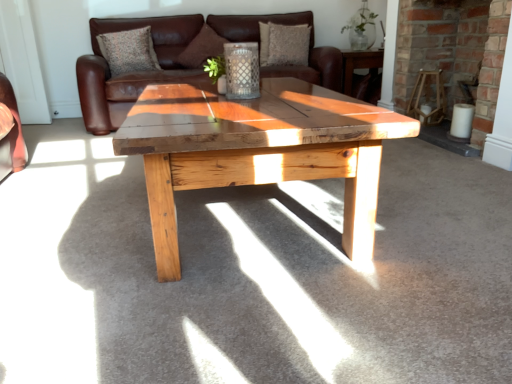
Question: Considering the relative sizes of brown suede pillow at center, which is the second pillow in right-to-left order, and brown leather couch at center in the image provided, is brown suede pillow at center, which is the second pillow in right-to-left order, shorter than brown leather couch at center?

Choices:
 (A) yes
 (B) no

Answer: (A)

Question: Is brown suede pillow at center, positioned as the second pillow in left-to-right order, aimed at brown leather couch at center?

Choices:
 (A) no
 (B) yes

Answer: (B)

Question: Is brown suede pillow at center, which is the second pillow in right-to-left order, not close to brown leather couch at center?

Choices:
 (A) no
 (B) yes

Answer: (A)

Question: From a real-world perspective, is brown suede pillow at center, which is the second pillow in right-to-left order, physically above brown leather couch at center?

Choices:
 (A) no
 (B) yes

Answer: (B)

Question: Is the depth of brown suede pillow at center, which is the second pillow in right-to-left order, greater than that of brown leather couch at center?

Choices:
 (A) no
 (B) yes

Answer: (B)

Question: Would you say brick fireplace at center is to the left or to the right of brown suede pillow at center, positioned as the second pillow in left-to-right order, in the picture?

Choices:
 (A) right
 (B) left

Answer: (A)

Question: In terms of height, does brick fireplace at center look taller or shorter compared to brown suede pillow at center, positioned as the second pillow in left-to-right order?

Choices:
 (A) short
 (B) tall

Answer: (B)

Question: From a real-world perspective, is brick fireplace at center above or below brown suede pillow at center, positioned as the second pillow in left-to-right order?

Choices:
 (A) below
 (B) above

Answer: (A)

Question: From the image's perspective, relative to brown suede pillow at center, positioned as the second pillow in left-to-right order, is brick fireplace at center above or below?

Choices:
 (A) below
 (B) above

Answer: (A)

Question: In the image, is brick fireplace at center positioned in front of or behind brown leather couch at center?

Choices:
 (A) front
 (B) behind

Answer: (A)

Question: From a real-world perspective, relative to brown leather couch at center, is brick fireplace at center vertically above or below?

Choices:
 (A) above
 (B) below

Answer: (A)

Question: From the image's perspective, is brick fireplace at center located above or below brown leather couch at center?

Choices:
 (A) below
 (B) above

Answer: (A)

Question: Which is correct: brick fireplace at center is inside brown leather couch at center, or outside of it?

Choices:
 (A) inside
 (B) outside

Answer: (B)

Question: Based on their sizes in the image, would you say wooden chair at right is bigger or smaller than brick fireplace at center?

Choices:
 (A) small
 (B) big

Answer: (A)

Question: Looking at their shapes, would you say wooden chair at right is wider or thinner than brick fireplace at center?

Choices:
 (A) thin
 (B) wide

Answer: (A)